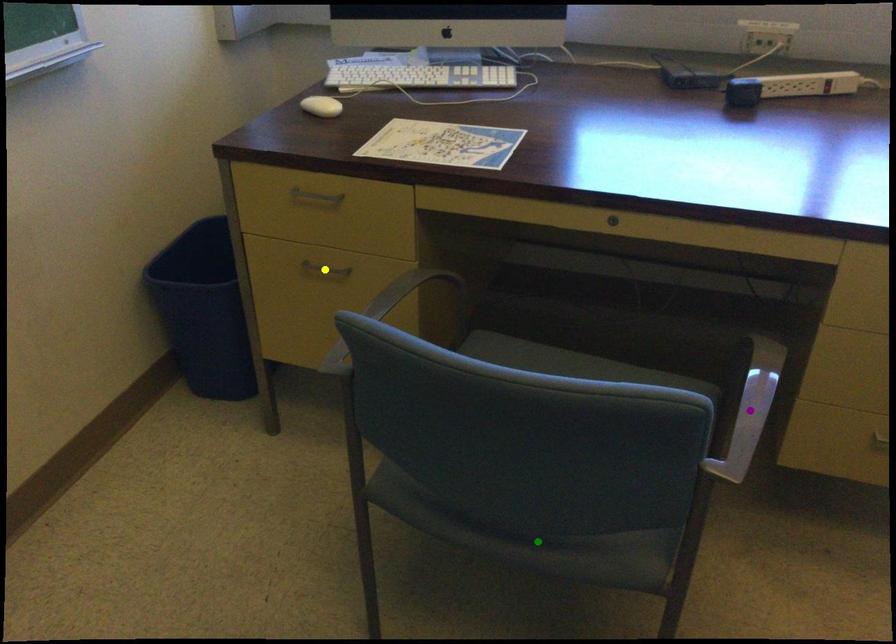
Order these from nearest to farthest:
A) yellow point
B) green point
C) purple point

green point
yellow point
purple point